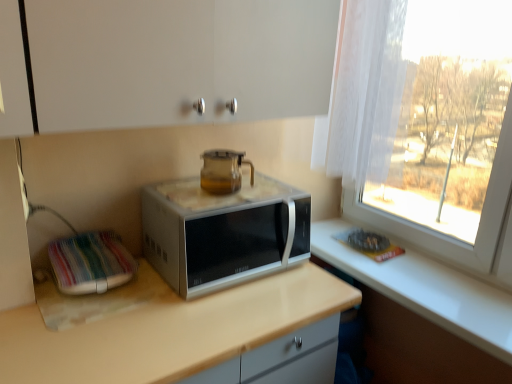
Identify the location of satin silver microwave at center. The width and height of the screenshot is (512, 384). (223, 232).

From the image's perspective, is satin silver microwave at center above transparent glass teapot at center?

No, from the image's perspective, satin silver microwave at center is not above transparent glass teapot at center.

Does satin silver microwave at center lie in front of transparent glass teapot at center?

Yes, it is.

Is satin silver microwave at center not close to transparent glass teapot at center?

No, there isn't a large distance between satin silver microwave at center and transparent glass teapot at center.

Between beige laminate countertop at center and transparent glass teapot at center, which one has more height?

Standing taller between the two is beige laminate countertop at center.

Is beige laminate countertop at center behind transparent glass teapot at center?

No, beige laminate countertop at center is in front of transparent glass teapot at center.

From a real-world perspective, which object stands above the other?

transparent glass teapot at center, from a real-world perspective.

Between beige laminate countertop at center and transparent glass teapot at center, which one has smaller width?

transparent glass teapot at center is thinner.

Which of these two, transparent glass teapot at center or satin silver microwave at center, is smaller?

transparent glass teapot at center.

The image size is (512, 384). What are the coordinates of `home appliance on the left of satin silver microwave at center` in the screenshot? It's located at (223, 171).

Consider the image. Considering the sizes of objects transparent glass teapot at center and satin silver microwave at center in the image provided, who is wider, transparent glass teapot at center or satin silver microwave at center?

satin silver microwave at center is wider.

Is the position of transparent glass teapot at center less distant than that of satin silver microwave at center?

No, transparent glass teapot at center is further to the viewer.

Considering the sizes of white fabric at left and transparent glass teapot at center in the image, is white fabric at left taller or shorter than transparent glass teapot at center?

Considering their sizes, white fabric at left has less height than transparent glass teapot at center.

What's the angular difference between white fabric at left and transparent glass teapot at center's facing directions?

They differ by 1.57 degrees in their facing directions.

Is white fabric at left to the right of transparent glass teapot at center from the viewer's perspective?

No, white fabric at left is not to the right of transparent glass teapot at center.

In the scene shown: Which point is more distant from viewer, (104, 255) or (212, 163)?

The point (212, 163) is more distant.

Considering the relative positions of beige laminate countertop at center and satin silver microwave at center in the image provided, is beige laminate countertop at center to the right of satin silver microwave at center from the viewer's perspective?

No, beige laminate countertop at center is not to the right of satin silver microwave at center.

Is beige laminate countertop at center inside or outside of satin silver microwave at center?

beige laminate countertop at center cannot be found inside satin silver microwave at center.

Is beige laminate countertop at center oriented away from satin silver microwave at center?

No.

Does beige laminate countertop at center have a greater height compared to satin silver microwave at center?

Correct, beige laminate countertop at center is much taller as satin silver microwave at center.

Is point (261, 321) positioned in front of point (73, 270)?

Yes, point (261, 321) is closer to viewer.

Does beige laminate countertop at center turn towards white fabric at left?

No, beige laminate countertop at center is not turned towards white fabric at left.

Is beige laminate countertop at center bigger or smaller than white fabric at left?

In the image, beige laminate countertop at center appears to be larger than white fabric at left.

Between transparent glass teapot at center and white fabric at left, which one appears on the right side from the viewer's perspective?

Positioned to the right is transparent glass teapot at center.

Which of these two, transparent glass teapot at center or white fabric at left, is bigger?

white fabric at left.

How much distance is there between transparent glass teapot at center and white fabric at left?

A distance of 17.01 inches exists between transparent glass teapot at center and white fabric at left.

Between point (213, 158) and point (78, 269), which one is positioned behind?

The point (213, 158) is farther from the camera.

Image resolution: width=512 pixels, height=384 pixels. I want to click on home appliance to the left of satin silver microwave at center, so click(223, 171).

Identify the location of countertop in front of the transparent glass teapot at center. (169, 332).

Estimate the real-world distances between objects in this image. Which object is further from transparent glass teapot at center, satin silver microwave at center or white fabric at left?

Based on the image, white fabric at left appears to be further to transparent glass teapot at center.

When comparing their distances from transparent glass teapot at center, does white fabric at left or satin silver microwave at center seem further?

white fabric at left is positioned further to the anchor transparent glass teapot at center.

Considering their positions, is satin silver microwave at center positioned further to beige laminate countertop at center than white fabric at left?

white fabric at left is positioned further to the anchor beige laminate countertop at center.

Estimate the real-world distances between objects in this image. Which object is closer to satin silver microwave at center, transparent glass teapot at center or white fabric at left?

transparent glass teapot at center is positioned closer to the anchor satin silver microwave at center.

When comparing their distances from satin silver microwave at center, does white fabric at left or transparent glass teapot at center seem closer?

transparent glass teapot at center lies closer to satin silver microwave at center than the other object.

From the image, which object appears to be nearer to beige laminate countertop at center, white fabric at left or satin silver microwave at center?

satin silver microwave at center is positioned closer to the anchor beige laminate countertop at center.

When comparing their distances from white fabric at left, does transparent glass teapot at center or beige laminate countertop at center seem further?

transparent glass teapot at center is positioned further to the anchor white fabric at left.

Estimate the real-world distances between objects in this image. Which object is closer to beige laminate countertop at center, satin silver microwave at center or transparent glass teapot at center?

Among the two, satin silver microwave at center is located nearer to beige laminate countertop at center.

Where is `home appliance between white fabric at left and satin silver microwave at center`? The image size is (512, 384). home appliance between white fabric at left and satin silver microwave at center is located at coordinates (223, 171).

You are a GUI agent. You are given a task and a screenshot of the screen. Output one action in this format:
    pyautogui.click(x=<x>, y=<y>)
    Task: Click on the appliance between transparent glass teapot at center and beige laminate countertop at center in the up-down direction
    
    Given the screenshot: What is the action you would take?
    pyautogui.click(x=90, y=263)

Locate an element on the screen. The height and width of the screenshot is (384, 512). appliance between satin silver microwave at center and beige laminate countertop at center from top to bottom is located at coordinates (90, 263).

Identify the location of microwave oven between transparent glass teapot at center and beige laminate countertop at center in the up-down direction. (223, 232).